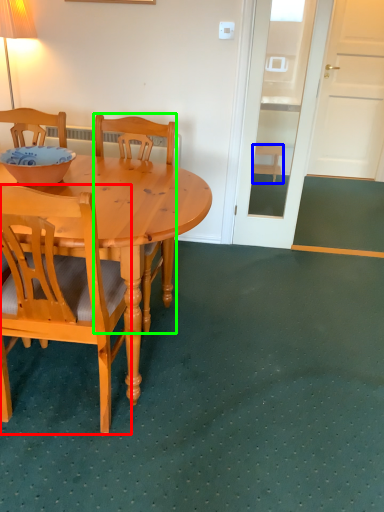
Question: Which object is the farthest from chair (highlighted by a red box)? Choose among these: stool (highlighted by a blue box) or chair (highlighted by a green box).

Choices:
 (A) stool
 (B) chair

Answer: (A)